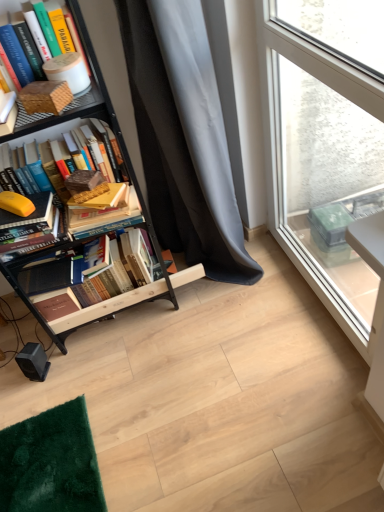
Where is `free location to the left of transparent glass window at upper right`? free location to the left of transparent glass window at upper right is located at coordinates (228, 344).